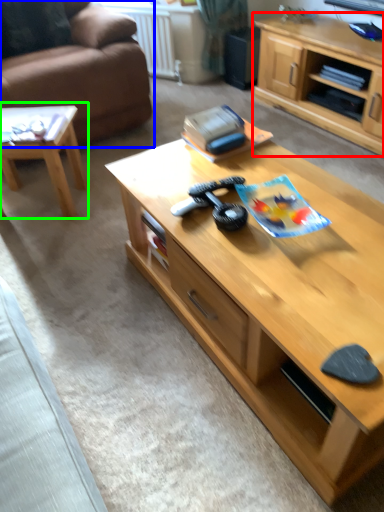
Question: Which is farther away from cabinetry (highlighted by a red box)? studio couch (highlighted by a blue box) or coffee table (highlighted by a green box)?

Choices:
 (A) studio couch
 (B) coffee table

Answer: (B)